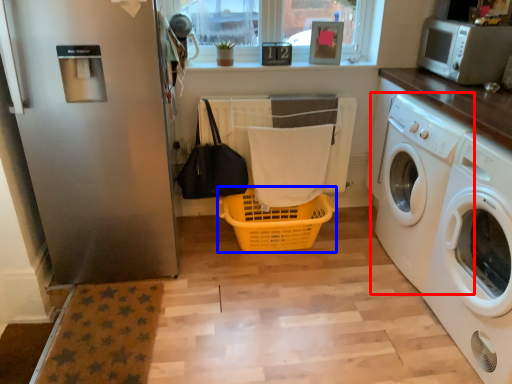
Question: Which object is closer to the camera taking this photo, washing machine (highlighted by a red box) or basket (highlighted by a blue box)?

Choices:
 (A) washing machine
 (B) basket

Answer: (A)